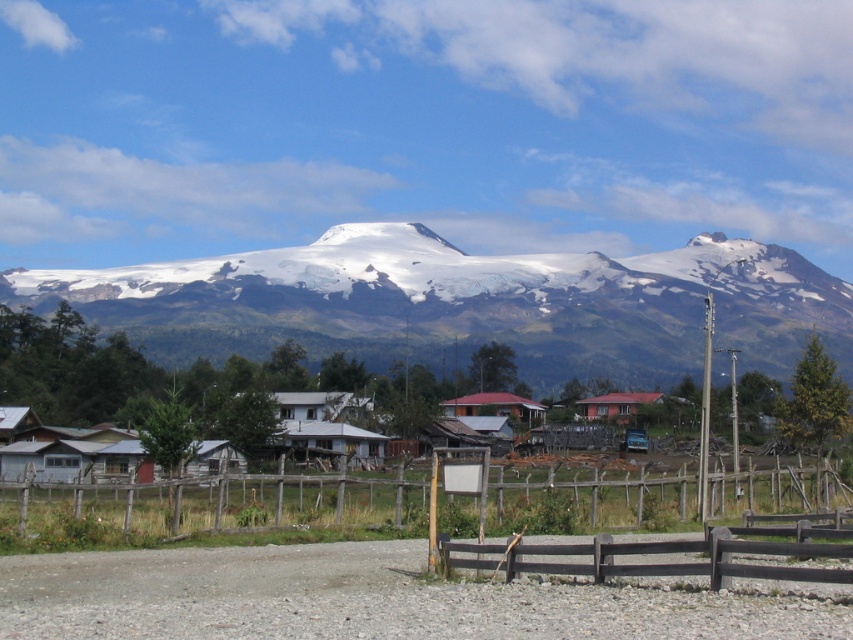
Is snowy rock mountain range at center thinner than red matte house at center?

No.

Between snowy rock mountain range at center and red matte house at center, which one appears on the right side from the viewer's perspective?

red matte house at center

Which is in front, point (274, 339) or point (611, 397)?

Point (611, 397) is more forward.

Find the location of a particular element. snowy rock mountain range at center is located at coordinates coord(467,305).

Which is below, brown wooden fence at lower center or red matte house at center?

Positioned lower is red matte house at center.

Consider the image. Who is positioned more to the left, brown wooden fence at lower center or red matte house at center?

From the viewer's perspective, brown wooden fence at lower center appears more on the left side.

Between point (560, 545) and point (619, 401), which one is positioned behind?

Positioned behind is point (619, 401).

The height and width of the screenshot is (640, 853). Find the location of `brown wooden fence at lower center`. brown wooden fence at lower center is located at coordinates (665, 554).

Is point (654, 340) closer to viewer compared to point (802, 500)?

No, (654, 340) is further to viewer.

Between snowy rock mountain range at center and wooden fence at center, which one appears on the right side from the viewer's perspective?

wooden fence at center is more to the right.

Who is more distant from viewer, (x=282, y=324) or (x=459, y=504)?

The point (x=282, y=324) is behind.

I want to click on snowy rock mountain range at center, so click(x=467, y=305).